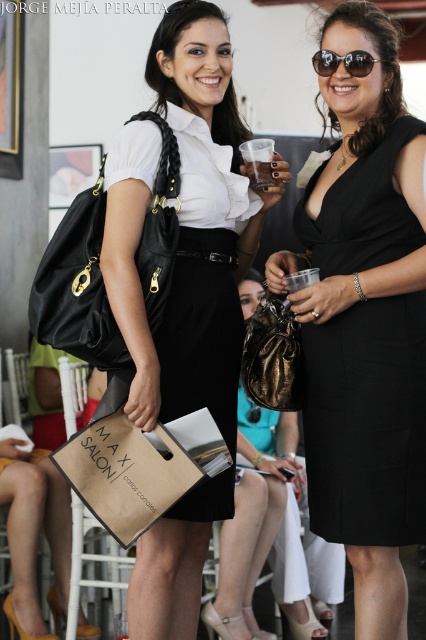
You are organizing a fashion show and need to know which item is taller between the matte black bag at center and the black reflective sunglasses at upper center. Could you determine this?

The matte black bag at center has a greater height compared to the black reflective sunglasses at upper center, so the matte black bag at center is taller.